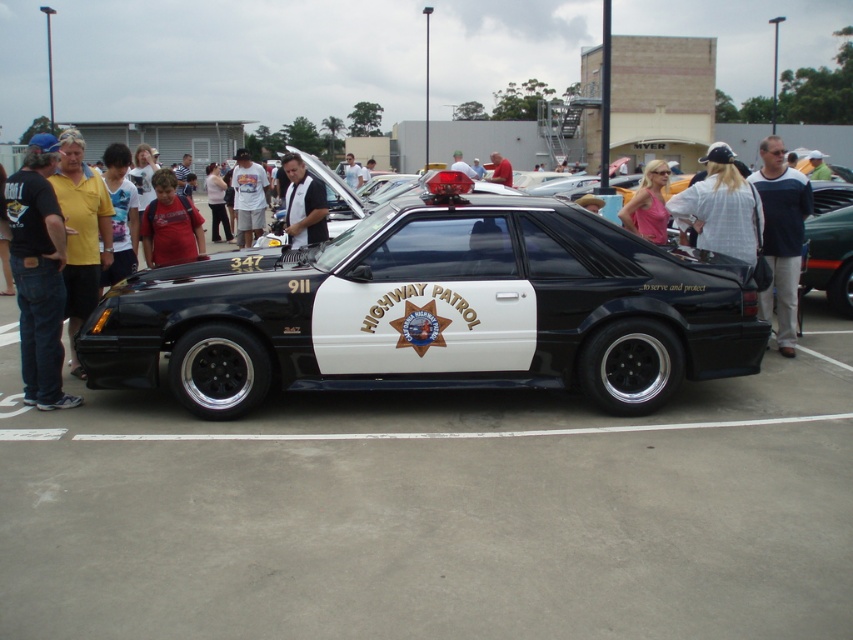
Question: From the image, what is the correct spatial relationship of metallic green car at center in relation to red shirt at center?

Choices:
 (A) above
 (B) below

Answer: (B)

Question: Which object is the closest to the black leather shirt at center?

Choices:
 (A) white shirt at center
 (B) pink fabric dress at upper center
 (C) matte red shirt at center
 (D) white checkered shirt at center

Answer: (C)

Question: Which object appears closest to the camera in this image?

Choices:
 (A) white checkered shirt at center
 (B) matte red shirt at center

Answer: (A)

Question: Can you confirm if white checkered shirt at center is thinner than pink fabric dress at upper center?

Choices:
 (A) yes
 (B) no

Answer: (B)

Question: Can you confirm if black denim jeans at left is bigger than metallic green car at center?

Choices:
 (A) no
 (B) yes

Answer: (B)

Question: Which point is farther to the camera?

Choices:
 (A) black denim jeans at left
 (B) white checkered shirt at center

Answer: (B)